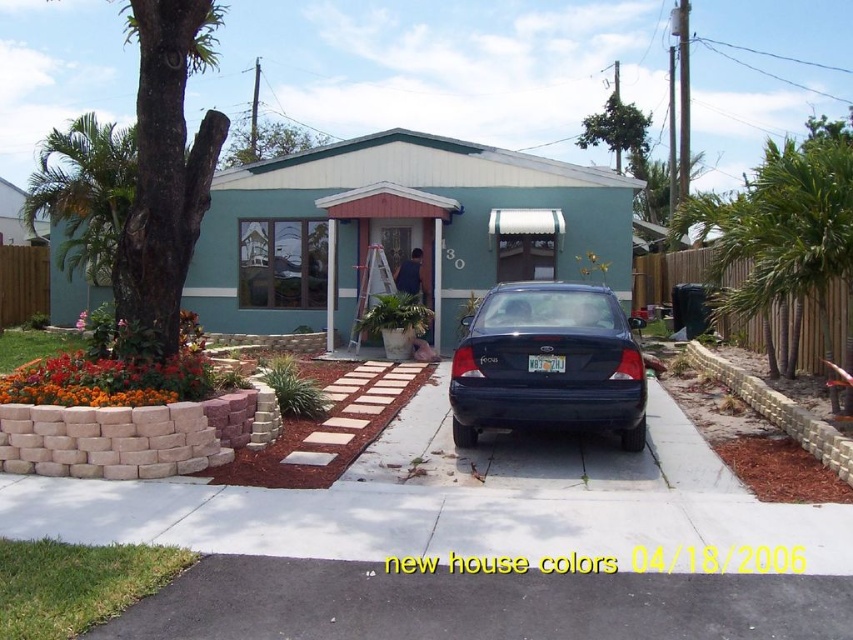
What do you see at coordinates (477, 604) in the screenshot? I see `black asphalt driveway at lower center` at bounding box center [477, 604].

Between black asphalt driveway at lower center and glossy dark blue sedan at center, which one has less height?

Standing shorter between the two is black asphalt driveway at lower center.

The width and height of the screenshot is (853, 640). What are the coordinates of `black asphalt driveway at lower center` in the screenshot? It's located at (477, 604).

Locate an element on the screen. The height and width of the screenshot is (640, 853). black asphalt driveway at lower center is located at coordinates (477, 604).